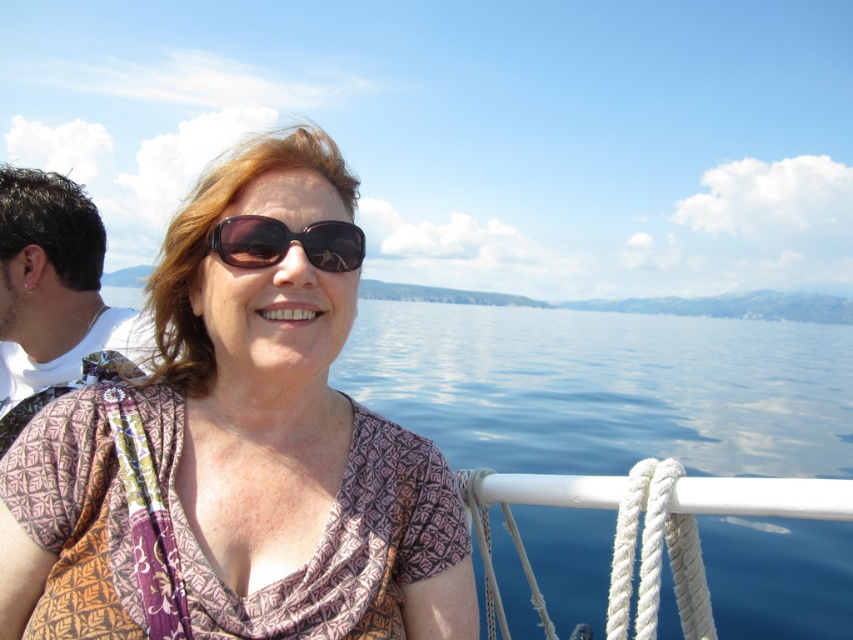
Question: Considering the real-world distances, which object is closest to the matte brown sunglasses at center?

Choices:
 (A) white fabric at left
 (B) matte brown blouse at center

Answer: (B)

Question: Can you confirm if matte brown blouse at center is bigger than white fabric at left?

Choices:
 (A) no
 (B) yes

Answer: (B)

Question: Considering the relative positions of matte brown blouse at center and matte brown sunglasses at center in the image provided, where is matte brown blouse at center located with respect to matte brown sunglasses at center?

Choices:
 (A) below
 (B) above

Answer: (A)

Question: Does white fabric at left appear on the right side of matte brown sunglasses at center?

Choices:
 (A) yes
 (B) no

Answer: (B)

Question: Based on their relative distances, which object is farther from the matte brown sunglasses at center?

Choices:
 (A) white fabric at left
 (B) matte brown blouse at center

Answer: (A)

Question: Which object is farther from the camera taking this photo?

Choices:
 (A) white fabric at left
 (B) matte brown blouse at center
 (C) matte brown sunglasses at center

Answer: (A)